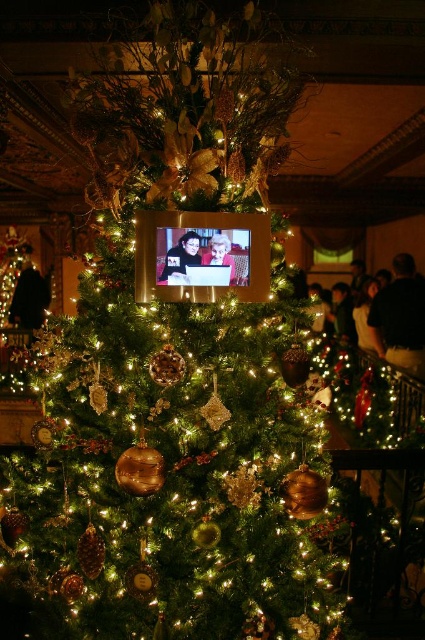
Who is positioned more to the left, matte black frame at center or matte black laptop at upper center?

matte black frame at center is more to the left.

Between point (167, 257) and point (223, 256), which one is positioned behind?

The point (223, 256) is more distant.

Is point (189, 253) in front of point (221, 257)?

Yes, it is in front of point (221, 257).

Where is `matte black frame at center`? This screenshot has height=640, width=425. matte black frame at center is located at coordinates (181, 257).